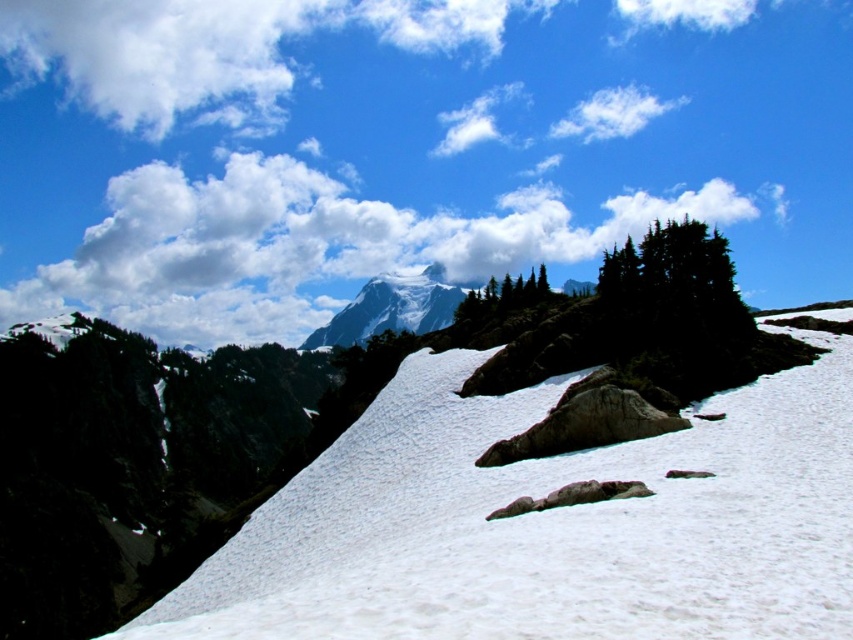
You are an alpine hiker planning to take a photo of the mountain peak. You have a camera with a zoom lens that can focus on objects at different distances. Which object should you focus on first to ensure the mountain peak is sharp in your photo? The white snow at center or the white fluffy cloud at upper center?

You should focus on the white snow at center first because it is in front of the white fluffy cloud at upper center, so focusing on the closer object will help ensure the mountain peak in the background is sharp.

You are a mountain climber planning to reach the white fluffy cloud at upper center. You have a rope that is 2000 feet long. Based on the scene, can you safely use this rope to reach the cloud from the white snow at center?

The white snow at center is 1902.40 feet from the white fluffy cloud at upper center. Since the rope is 2000 feet long, which is longer than the distance, you can safely use the rope to reach the cloud from the white snow at center.